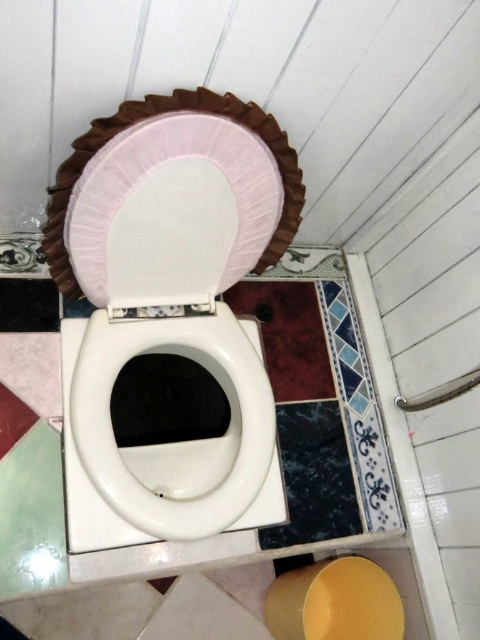
Question: Which object is farther from the camera taking this photo?

Choices:
 (A) white glossy toilet bowl at center
 (B) pink fabric toilet seat cover at center

Answer: (A)

Question: Among these objects, which one is nearest to the camera?

Choices:
 (A) white glossy toilet bowl at center
 (B) pink fabric toilet seat cover at center

Answer: (B)

Question: Does white glossy toilet bowl at center appear on the left side of pink fabric toilet seat cover at center?

Choices:
 (A) yes
 (B) no

Answer: (A)

Question: Can you confirm if white glossy toilet bowl at center is wider than pink fabric toilet seat cover at center?

Choices:
 (A) yes
 (B) no

Answer: (A)

Question: Is white glossy toilet bowl at center to the right of pink fabric toilet seat cover at center from the viewer's perspective?

Choices:
 (A) yes
 (B) no

Answer: (B)

Question: Which of the following is the closest to the observer?

Choices:
 (A) (130, 225)
 (B) (159, 451)

Answer: (A)